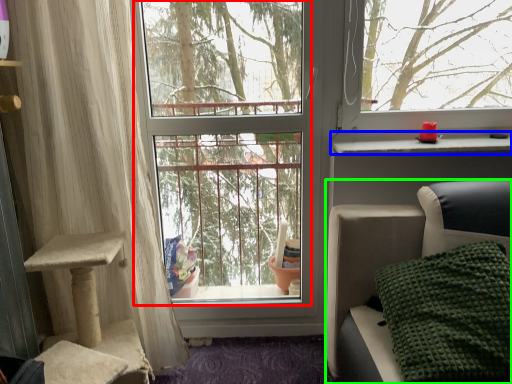
Question: Considering the real-world distances, which object is closest to window screen (highlighted by a red box)? window sill (highlighted by a blue box) or furniture (highlighted by a green box).

Choices:
 (A) window sill
 (B) furniture

Answer: (B)